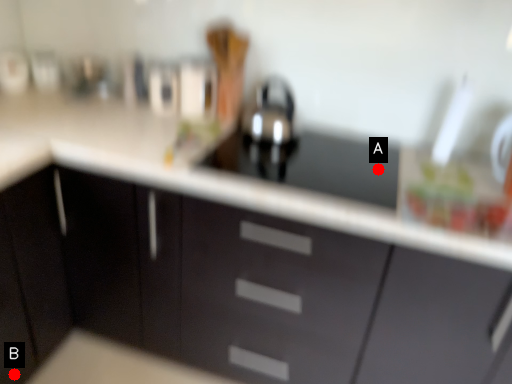
Question: Two points are circled on the image, labeled by A and B beside each circle. Which point is closer to the camera?

Choices:
 (A) A is closer
 (B) B is closer

Answer: (B)